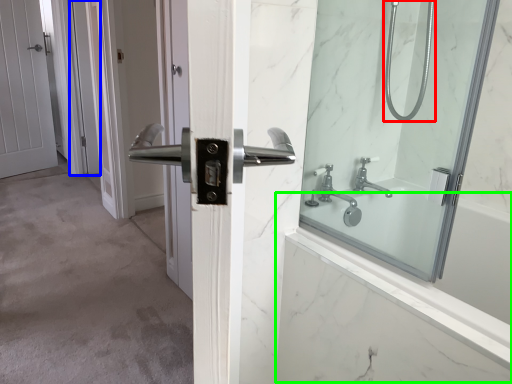
Question: Estimate the real-world distances between objects in this image. Which object is closer to shower head (highlighted by a red box), screen door (highlighted by a blue box) or bath (highlighted by a green box)?

Choices:
 (A) screen door
 (B) bath

Answer: (B)